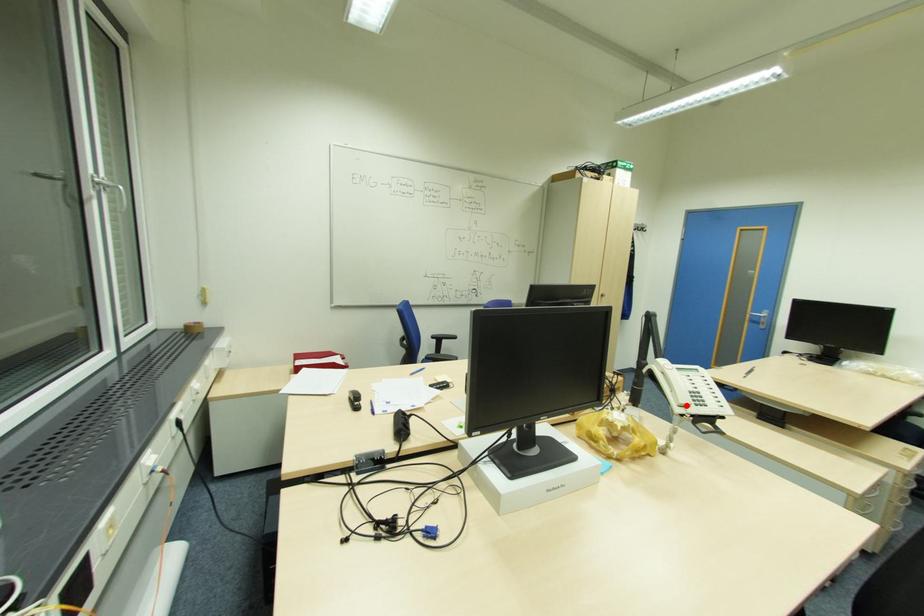
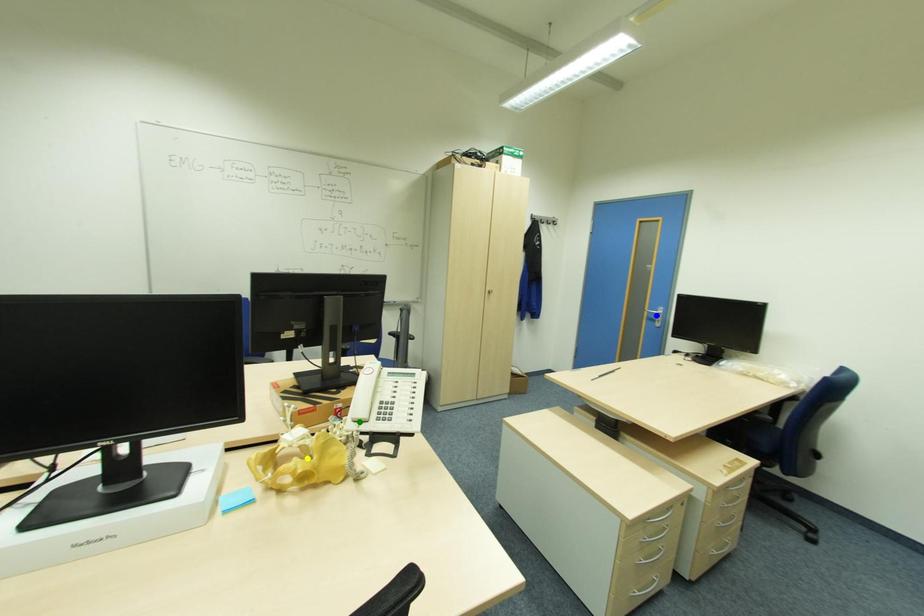
Question: I am providing you with two images of the same scene from different viewpoints. A red point is marked on the first image. You are given multiple points on the second image. In image 2, which mark is for the same physical point as the one in image 1?

Choices:
 (A) blue point
 (B) yellow point
 (C) green point

Answer: (C)